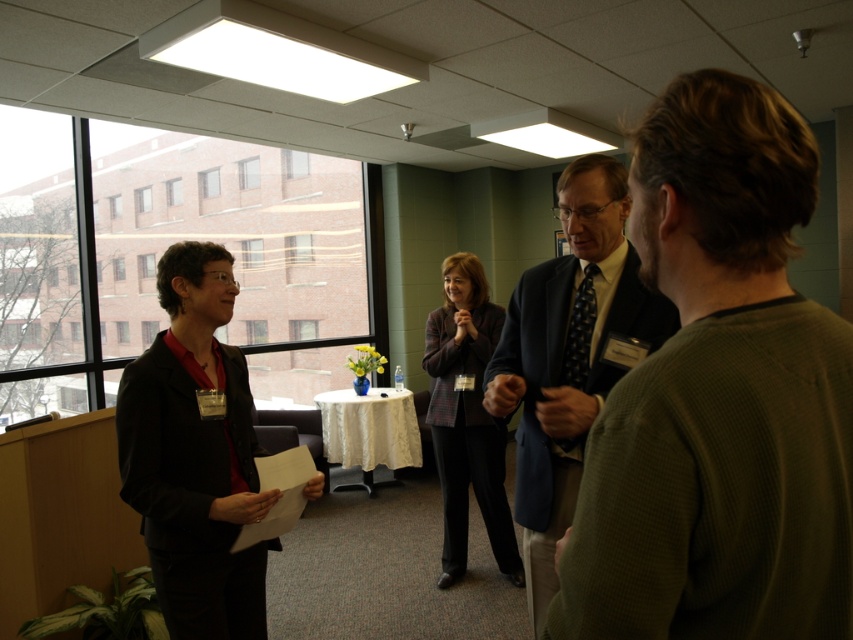
Between dark blue suit at center and plaid fabric blazer at center, which one appears on the left side from the viewer's perspective?

plaid fabric blazer at center

Does dark blue suit at center appear on the right side of plaid fabric blazer at center?

Yes, dark blue suit at center is to the right of plaid fabric blazer at center.

The width and height of the screenshot is (853, 640). What are the coordinates of `dark blue suit at center` in the screenshot? It's located at (567, 355).

Is black matte blazer at left shorter than plaid fabric blazer at center?

Yes.

Is black matte blazer at left wider than plaid fabric blazer at center?

Indeed, black matte blazer at left has a greater width compared to plaid fabric blazer at center.

Where is `black matte blazer at left`? This screenshot has width=853, height=640. black matte blazer at left is located at coordinates (195, 456).

Does green textured sweater at right appear under plaid fabric blazer at center?

Incorrect, green textured sweater at right is not positioned below plaid fabric blazer at center.

Find the location of a particular element. The width and height of the screenshot is (853, 640). green textured sweater at right is located at coordinates (718, 397).